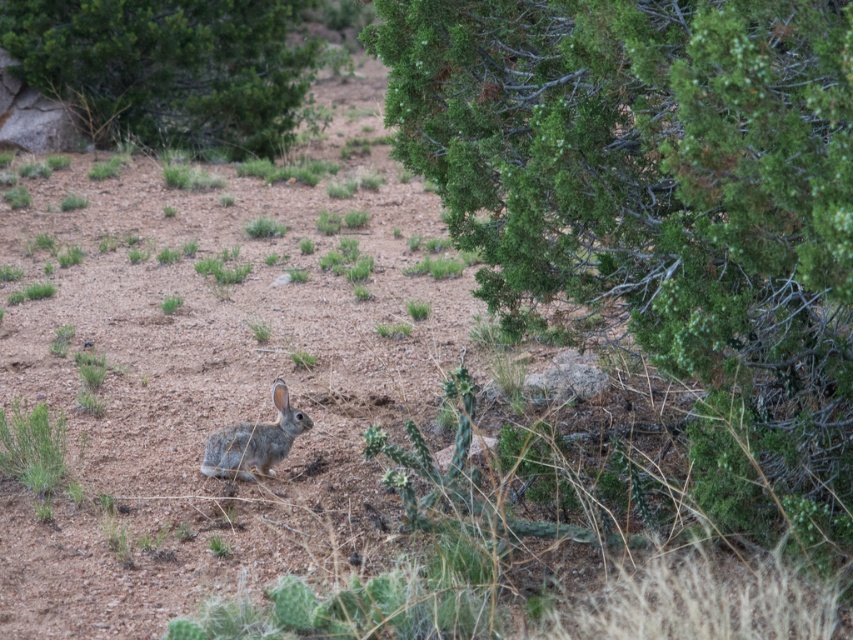
Measure the distance from green textured tree at center right to green leafy tree at upper left.

A distance of 30.69 feet exists between green textured tree at center right and green leafy tree at upper left.

Is green textured tree at center right positioned in front of green leafy tree at upper left?

Yes, it is.

Where is `green textured tree at center right`? The image size is (853, 640). green textured tree at center right is located at coordinates (663, 209).

The image size is (853, 640). In order to click on green textured tree at center right in this screenshot , I will do `click(663, 209)`.

Is green textured tree at center right wider than fuzzy gray rabbit at center?

Yes.

How distant is green textured tree at center right from fuzzy gray rabbit at center?

green textured tree at center right is 7.01 feet away from fuzzy gray rabbit at center.

The image size is (853, 640). What do you see at coordinates (663, 209) in the screenshot? I see `green textured tree at center right` at bounding box center [663, 209].

Locate an element on the screen. This screenshot has width=853, height=640. green textured tree at center right is located at coordinates (663, 209).

Is green leafy tree at upper left shorter than fuzzy gray rabbit at center?

No, green leafy tree at upper left is not shorter than fuzzy gray rabbit at center.

Does green leafy tree at upper left have a larger size compared to fuzzy gray rabbit at center?

Indeed, green leafy tree at upper left has a larger size compared to fuzzy gray rabbit at center.

Where is `green leafy tree at upper left`? The height and width of the screenshot is (640, 853). green leafy tree at upper left is located at coordinates (167, 67).

You are a GUI agent. You are given a task and a screenshot of the screen. Output one action in this format:
    pyautogui.click(x=<x>, y=<y>)
    Task: Click on the green leafy tree at upper left
    Image resolution: width=853 pixels, height=640 pixels.
    Given the screenshot: What is the action you would take?
    pyautogui.click(x=167, y=67)